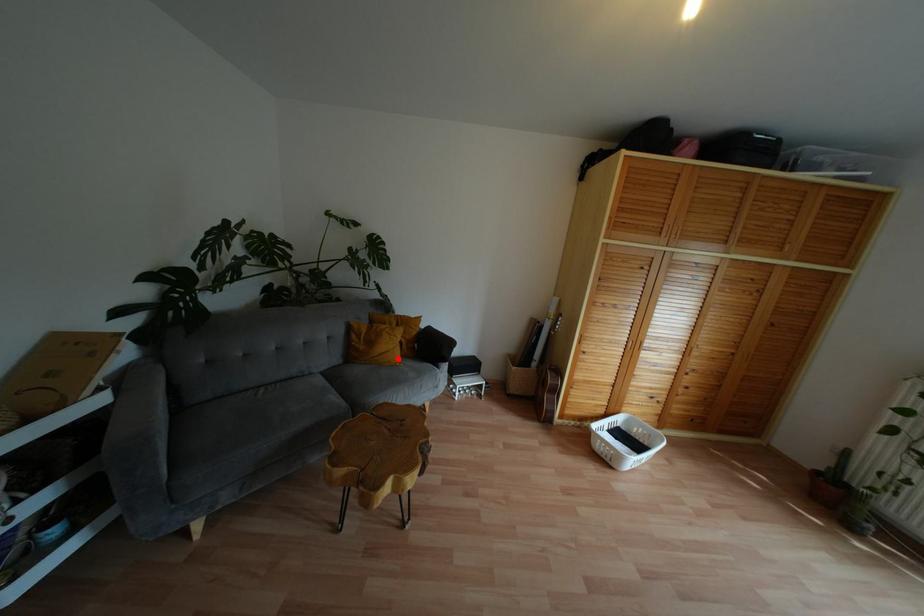
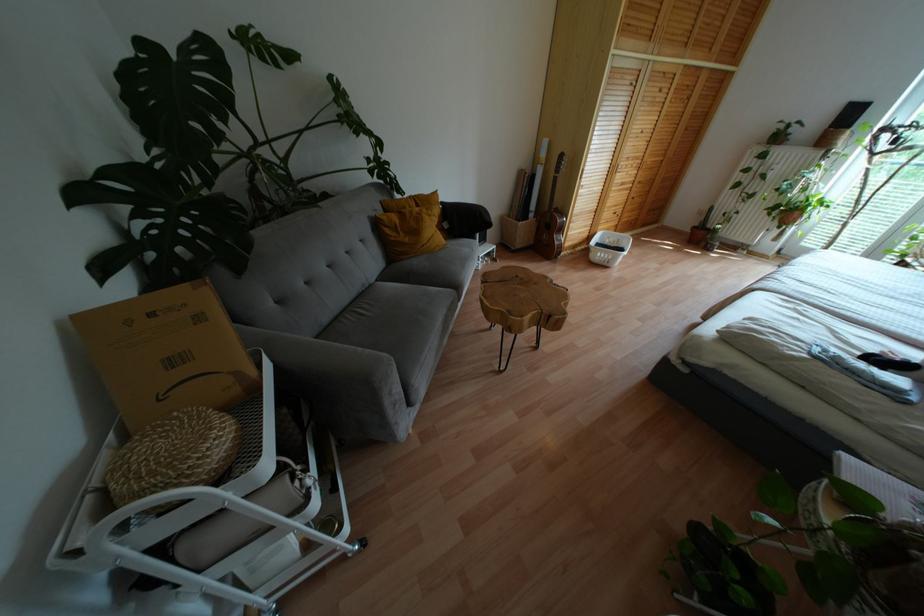
Question: I am providing you with two images of the same scene from different viewpoints. Given a red point in image1, look at the same physical point in image2. Is it:

Choices:
 (A) Closer to the viewpoint
 (B) Farther from the viewpoint

Answer: (A)